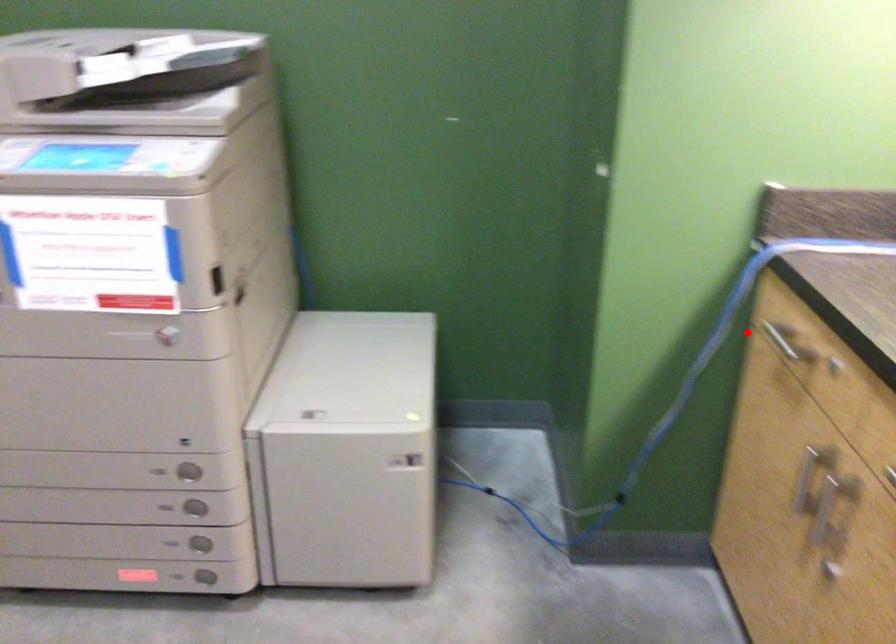
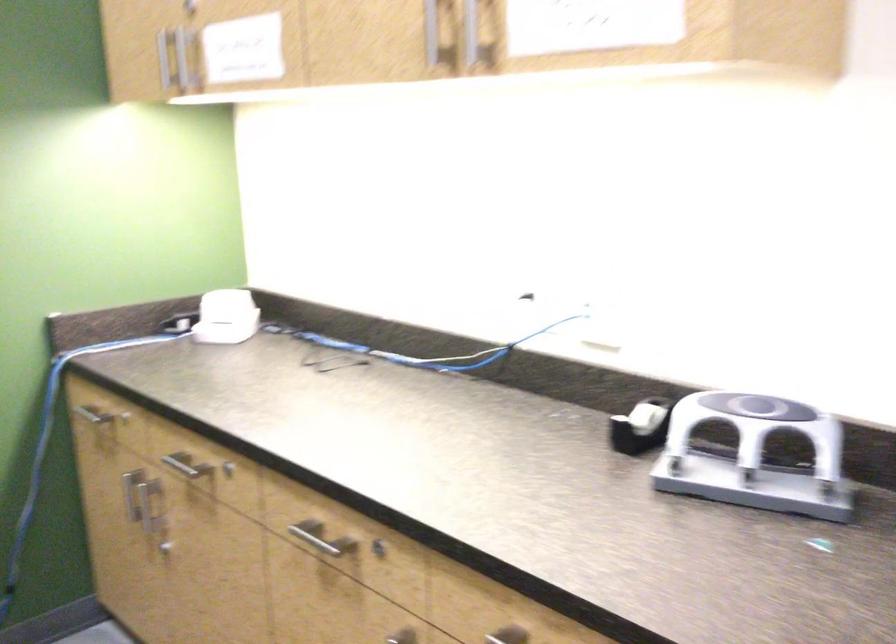
Locate, in the second image, the point that corresponds to the highlighted location in the first image.

(92, 413)